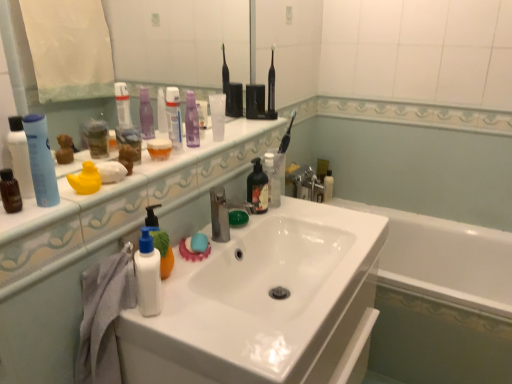
Question: Does white matte lotion at center, positioned as the 4th toiletry in back-to-front order, have a smaller size compared to translucent plastic bottle at center, arranged as the second mouthwash when viewed from the back?

Choices:
 (A) no
 (B) yes

Answer: (B)

Question: From the image's perspective, is white matte lotion at center, the 2th toiletry when ordered from front to back, on top of translucent plastic bottle at center, which is the 5th mouthwash from left to right?

Choices:
 (A) no
 (B) yes

Answer: (A)

Question: Is white matte lotion at center, the 3th toiletry from the right, aimed at translucent plastic bottle at center, arranged as the second mouthwash when viewed from the back?

Choices:
 (A) no
 (B) yes

Answer: (A)

Question: Considering the relative sizes of white matte lotion at center, the third toiletry viewed from the left, and translucent plastic bottle at center, arranged as the second mouthwash when viewed from the back, in the image provided, is white matte lotion at center, the third toiletry viewed from the left, shorter than translucent plastic bottle at center, arranged as the second mouthwash when viewed from the back,?

Choices:
 (A) no
 (B) yes

Answer: (B)

Question: From a real-world perspective, is white matte lotion at center, positioned as the 4th toiletry in back-to-front order, below translucent plastic bottle at center, arranged as the second mouthwash when viewed from the back?

Choices:
 (A) yes
 (B) no

Answer: (B)

Question: Is transparent plastic mouthwash at center, arranged as the fourth mouthwash when viewed from the front, spatially inside rubber duck at left, placed as the 4th toiletry when sorted from right to left, or outside of it?

Choices:
 (A) inside
 (B) outside

Answer: (B)

Question: Would you say transparent plastic mouthwash at center, marked as the 3th mouthwash in a back-to-front arrangement, is to the left or to the right of rubber duck at left, placed as the 4th toiletry when sorted from right to left, in the picture?

Choices:
 (A) right
 (B) left

Answer: (A)

Question: From a real-world perspective, is transparent plastic mouthwash at center, the fourth mouthwash from the left, positioned above or below rubber duck at left, placed as the 3th toiletry when sorted from front to back?

Choices:
 (A) below
 (B) above

Answer: (B)

Question: In the image, is transparent plastic mouthwash at center, the fourth mouthwash from the left, positioned in front of or behind rubber duck at left, which is counted as the 3th toiletry, starting from the back?

Choices:
 (A) behind
 (B) front

Answer: (A)

Question: Considering the positions of clear glass mirror at upper center and translucent plastic cup at center, acting as the 5th mouthwash starting from the right, in the image, is clear glass mirror at upper center bigger or smaller than translucent plastic cup at center, acting as the 5th mouthwash starting from the right,?

Choices:
 (A) big
 (B) small

Answer: (A)

Question: Is point (5, 100) positioned closer to the camera than point (161, 147)?

Choices:
 (A) closer
 (B) farther

Answer: (A)

Question: Looking at their shapes, would you say clear glass mirror at upper center is wider or thinner than translucent plastic cup at center, arranged as the second mouthwash when viewed from the left?

Choices:
 (A) wide
 (B) thin

Answer: (B)

Question: In the image, is clear glass mirror at upper center positioned in front of or behind translucent plastic cup at center, the 2th mouthwash in the front-to-back sequence?

Choices:
 (A) front
 (B) behind

Answer: (A)

Question: Relative to white matte lotion at center, positioned as the 4th toiletry in back-to-front order, is brown matte bottle at left, the sixth mouthwash viewed from the right, in front or behind?

Choices:
 (A) front
 (B) behind

Answer: (A)

Question: From a real-world perspective, relative to white matte lotion at center, the 3th toiletry from the right, is brown matte bottle at left, positioned as the 6th mouthwash in back-to-front order, vertically above or below?

Choices:
 (A) below
 (B) above

Answer: (B)